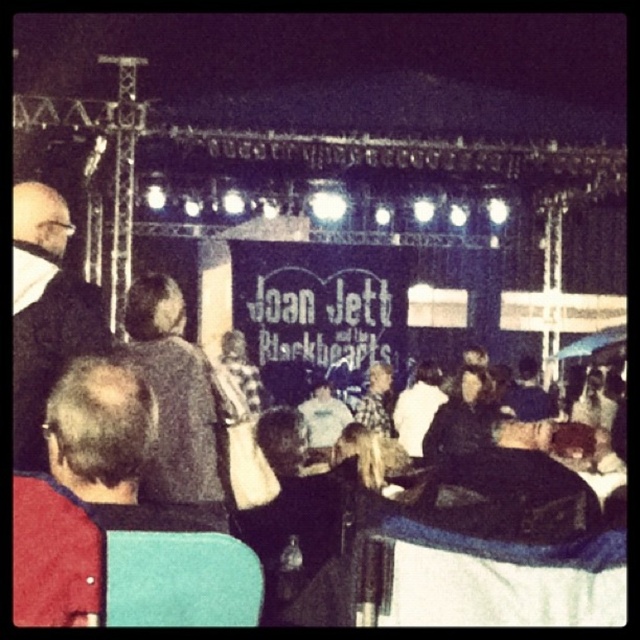
Does point (198, 477) lie behind point (461, 416)?

No, (198, 477) is in front of (461, 416).

Which is behind, point (125, 326) or point (464, 451)?

The point (464, 451) is behind.

Is point (221, 477) positioned behind point (480, 420)?

No, it is in front of (480, 420).

Identify the location of dark gray sweater at center. The height and width of the screenshot is (640, 640). (176, 397).

Is black matte jacket at center bigger than checkered fabric shirt at center?

Correct, black matte jacket at center is larger in size than checkered fabric shirt at center.

Between point (456, 403) and point (388, 369), which one is positioned in front?

Point (456, 403) is in front.

Find the location of a particular element. black matte jacket at center is located at coordinates (461, 417).

Does dark gray sweater at center have a lesser width compared to smooth gray shirt at center?

No, dark gray sweater at center is not thinner than smooth gray shirt at center.

Does point (196, 438) come in front of point (332, 397)?

Yes, it is in front of point (332, 397).

The width and height of the screenshot is (640, 640). I want to click on dark gray sweater at center, so click(176, 397).

You are a GUI agent. You are given a task and a screenshot of the screen. Output one action in this format:
    pyautogui.click(x=<x>, y=<y>)
    Task: Click on the dark gray sweater at center
    The width and height of the screenshot is (640, 640).
    Given the screenshot: What is the action you would take?
    pyautogui.click(x=176, y=397)